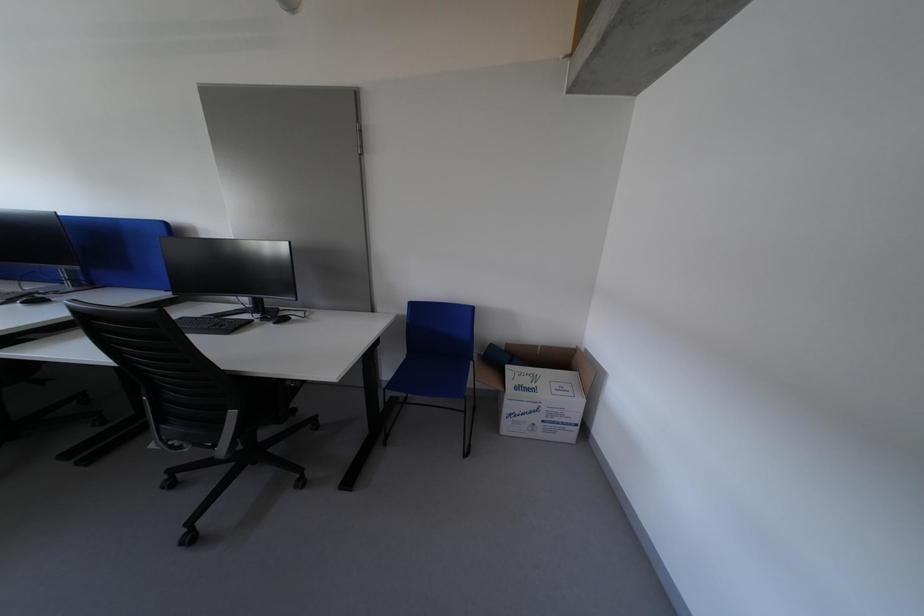
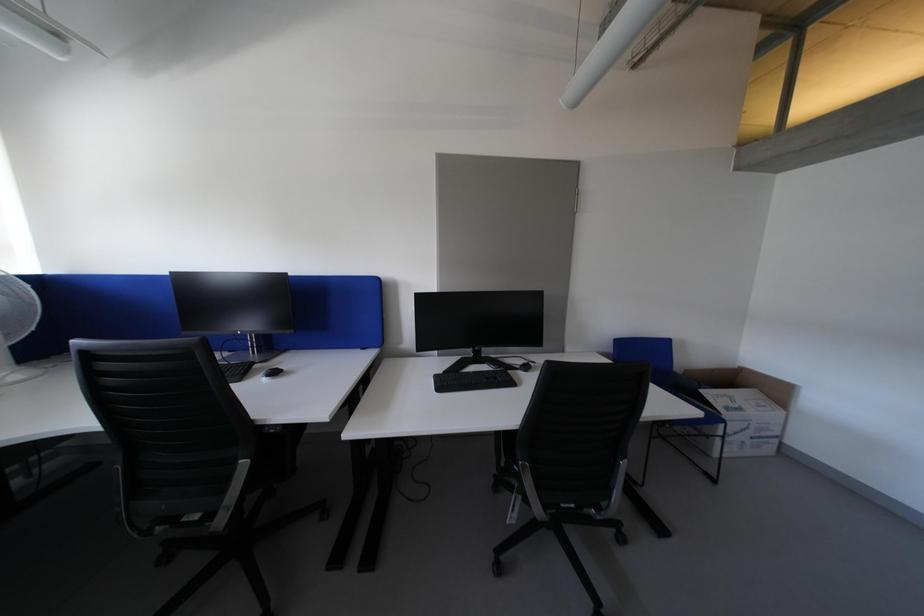
Question: The images are taken continuously from a first-person perspective. In which direction are you moving?

Choices:
 (A) Left
 (B) Right
 (C) Forward
 (D) Backward

Answer: (A)